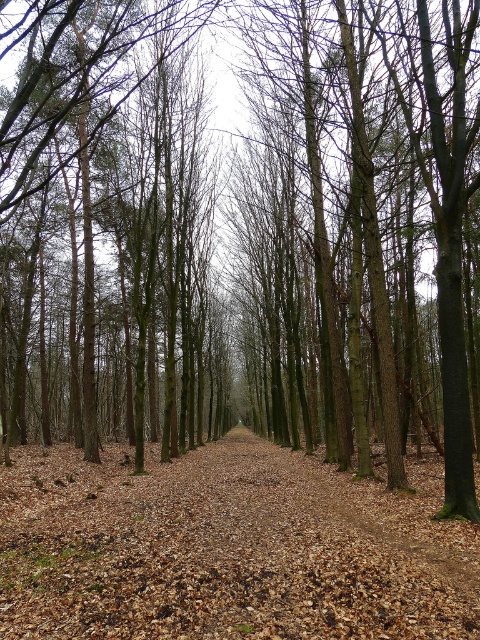
You are a hiker walking along the path in the forest scene. You notice the brown leafy trail at center and the brown smooth tree at center. Which one appears smaller in size?

The brown leafy trail at center is smaller than the brown smooth tree at center.

You are standing on the path in the forest scene. You want to see the view behind the brown leafy trail at center. Can you move forward along the path to get a better view of the brown smooth tree at center?

The brown smooth tree at center is behind the brown leafy trail at center, so moving forward along the path might allow you to see it better by getting closer to the tree and moving past the trail.

You are standing on the path in the forest scene. You see the brown leafy trail at center and the brown smooth tree at center. Which object is positioned to the right of the other?

The brown leafy trail at center is to the right of the brown smooth tree at center.